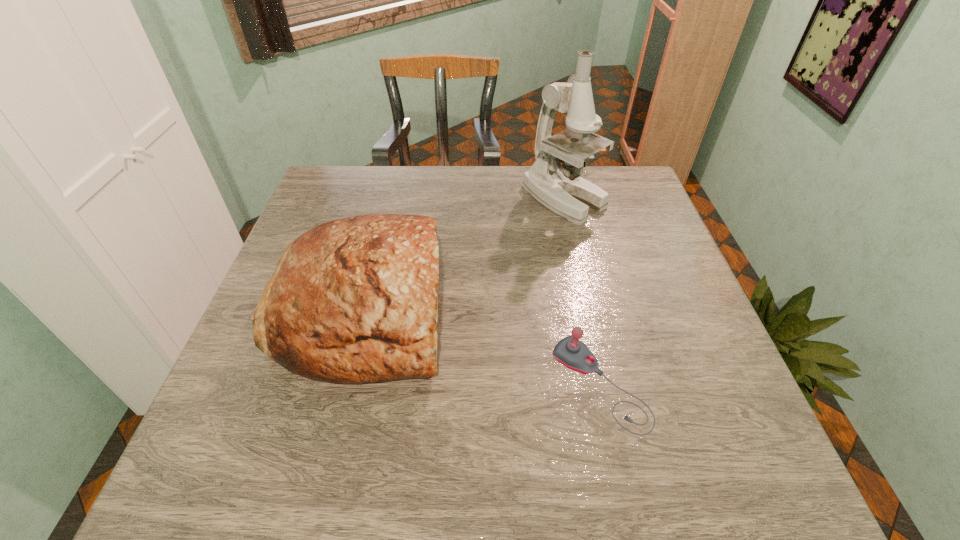
Where is `object positioned at the right edge`? The width and height of the screenshot is (960, 540). object positioned at the right edge is located at coordinates (560, 188).

In order to click on object that is positioned at the far right corner in this screenshot , I will do `click(560, 188)`.

Where is `vacant area at the far edge`? vacant area at the far edge is located at coordinates (436, 210).

In the image, there is a desktop. Where is `vacant space at the near edge`? vacant space at the near edge is located at coordinates (541, 488).

The width and height of the screenshot is (960, 540). Identify the location of blank space at the left edge of the desktop. coord(305,218).

This screenshot has width=960, height=540. I want to click on vacant area at the right edge, so click(676, 322).

You are a GUI agent. You are given a task and a screenshot of the screen. Output one action in this format:
    pyautogui.click(x=<x>, y=<y>)
    Task: Click on the vacant space at the far left corner
    The width and height of the screenshot is (960, 540).
    Given the screenshot: What is the action you would take?
    pyautogui.click(x=371, y=174)

What are the coordinates of `vacant region at the near left corner` in the screenshot? It's located at (268, 465).

I want to click on free space at the far right corner, so click(612, 178).

Find the location of a particular element. vacant space at the near right corner is located at coordinates (703, 441).